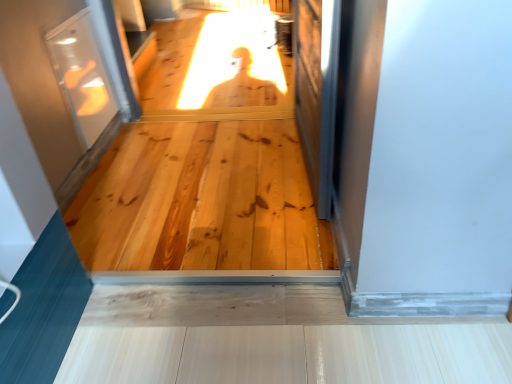
Question: Does transparent glass screen door at right, the second screen door viewed from the left, appear on the right side of clear glass screen door at upper left, the 1th screen door when ordered from left to right?

Choices:
 (A) no
 (B) yes

Answer: (B)

Question: Are transparent glass screen door at right, the second screen door viewed from the left, and clear glass screen door at upper left, the second screen door viewed from the right, making contact?

Choices:
 (A) yes
 (B) no

Answer: (B)

Question: From the image's perspective, is transparent glass screen door at right, the second screen door viewed from the left, below clear glass screen door at upper left, the 1th screen door when ordered from left to right?

Choices:
 (A) no
 (B) yes

Answer: (B)

Question: From a real-world perspective, is transparent glass screen door at right, the first screen door from the right, physically above clear glass screen door at upper left, the 1th screen door when ordered from left to right?

Choices:
 (A) yes
 (B) no

Answer: (A)

Question: From the image's perspective, is transparent glass screen door at right, the first screen door from the right, over clear glass screen door at upper left, the 1th screen door when ordered from left to right?

Choices:
 (A) no
 (B) yes

Answer: (A)

Question: Is point (96, 66) positioned closer to the camera than point (304, 4)?

Choices:
 (A) closer
 (B) farther

Answer: (B)

Question: Considering the positions of clear glass screen door at upper left, the 1th screen door when ordered from left to right, and transparent glass screen door at right, the first screen door from the right, in the image, is clear glass screen door at upper left, the 1th screen door when ordered from left to right, bigger or smaller than transparent glass screen door at right, the first screen door from the right,?

Choices:
 (A) big
 (B) small

Answer: (B)

Question: Is clear glass screen door at upper left, the second screen door viewed from the right, to the left or to the right of transparent glass screen door at right, the second screen door viewed from the left, in the image?

Choices:
 (A) right
 (B) left

Answer: (B)

Question: From the image's perspective, is clear glass screen door at upper left, the 1th screen door when ordered from left to right, above or below transparent glass screen door at right, the second screen door viewed from the left?

Choices:
 (A) below
 (B) above

Answer: (B)

Question: Looking at their shapes, would you say natural wood flooring at center is wider or thinner than clear glass screen door at upper left, the 1th screen door when ordered from left to right?

Choices:
 (A) wide
 (B) thin

Answer: (A)

Question: In terms of height, does natural wood flooring at center look taller or shorter compared to clear glass screen door at upper left, the 1th screen door when ordered from left to right?

Choices:
 (A) tall
 (B) short

Answer: (B)

Question: In the image, is natural wood flooring at center on the left side or the right side of clear glass screen door at upper left, the second screen door viewed from the right?

Choices:
 (A) left
 (B) right

Answer: (B)

Question: From the image's perspective, relative to clear glass screen door at upper left, the second screen door viewed from the right, is natural wood flooring at center above or below?

Choices:
 (A) below
 (B) above

Answer: (A)

Question: Considering the positions of point (316, 51) and point (87, 77), is point (316, 51) closer or farther from the camera than point (87, 77)?

Choices:
 (A) farther
 (B) closer

Answer: (B)

Question: In terms of height, does transparent glass screen door at right, the first screen door from the right, look taller or shorter compared to clear glass screen door at upper left, the 1th screen door when ordered from left to right?

Choices:
 (A) tall
 (B) short

Answer: (A)